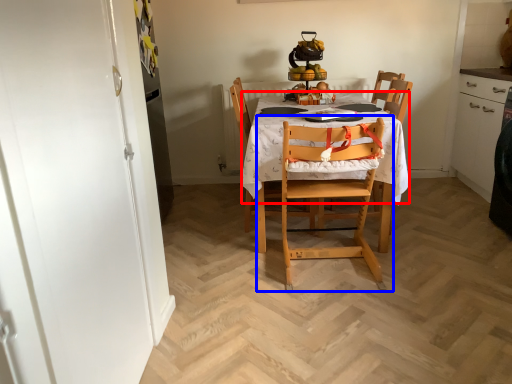
Question: Which object is closer to the camera taking this photo, tablecloth (highlighted by a red box) or chair (highlighted by a blue box)?

Choices:
 (A) tablecloth
 (B) chair

Answer: (B)